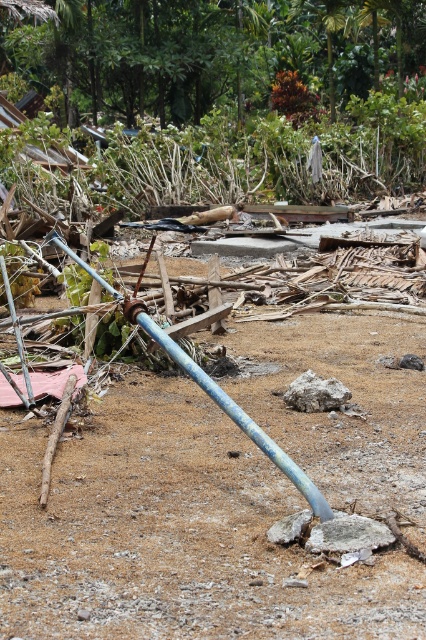
Between brown sandy dirt at center and blue painted metal water pipe at center, which one is positioned lower?

brown sandy dirt at center is lower down.

Who is more forward, (198, 550) or (146, 310)?

Point (198, 550) is in front.

Where is `brown sandy dirt at center`? This screenshot has width=426, height=640. brown sandy dirt at center is located at coordinates [x=172, y=531].